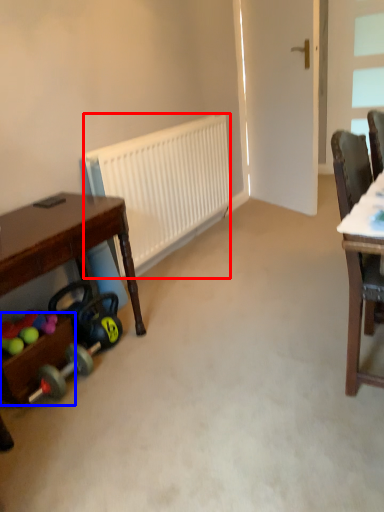
Question: Which of the following is the farthest to the observer, radiator (highlighted by a red box) or drawer (highlighted by a blue box)?

Choices:
 (A) radiator
 (B) drawer

Answer: (A)